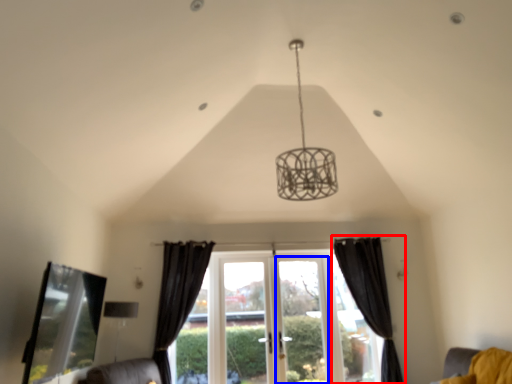
Question: Which object is closer to the camera taking this photo, curtain (highlighted by a red box) or screen door (highlighted by a blue box)?

Choices:
 (A) curtain
 (B) screen door

Answer: (A)